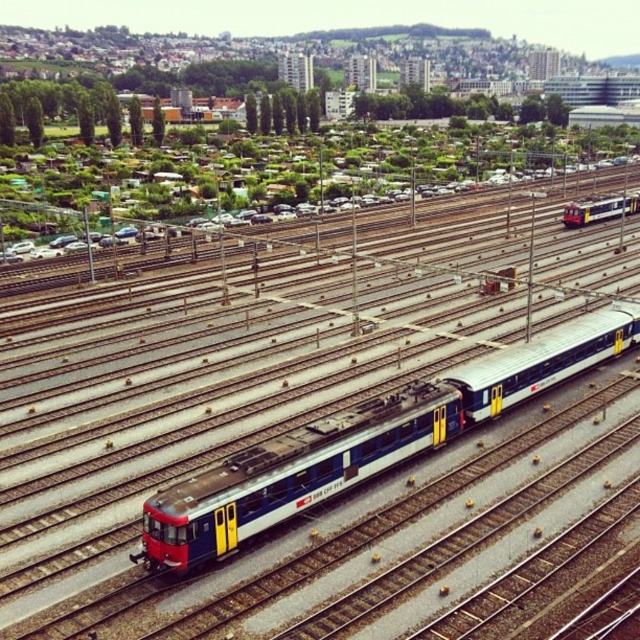
You are a GUI agent. You are given a task and a screenshot of the screen. Output one action in this format:
    pyautogui.click(x=<x>, y=<y>)
    Task: Click on the matte blue passenger train at center
    
    Given the screenshot: What is the action you would take?
    pyautogui.click(x=364, y=442)

Identify the location of matte blue passenger train at center. (364, 442).